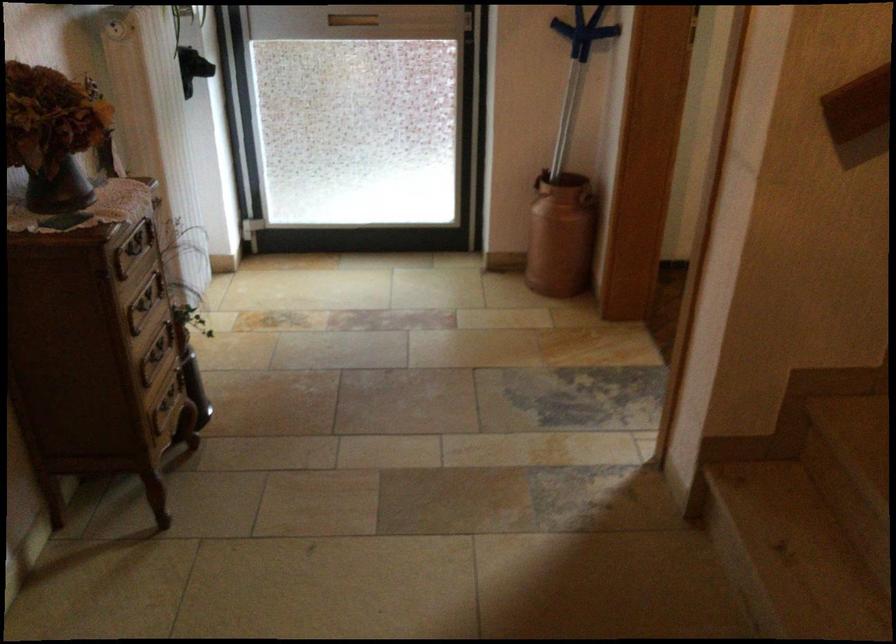
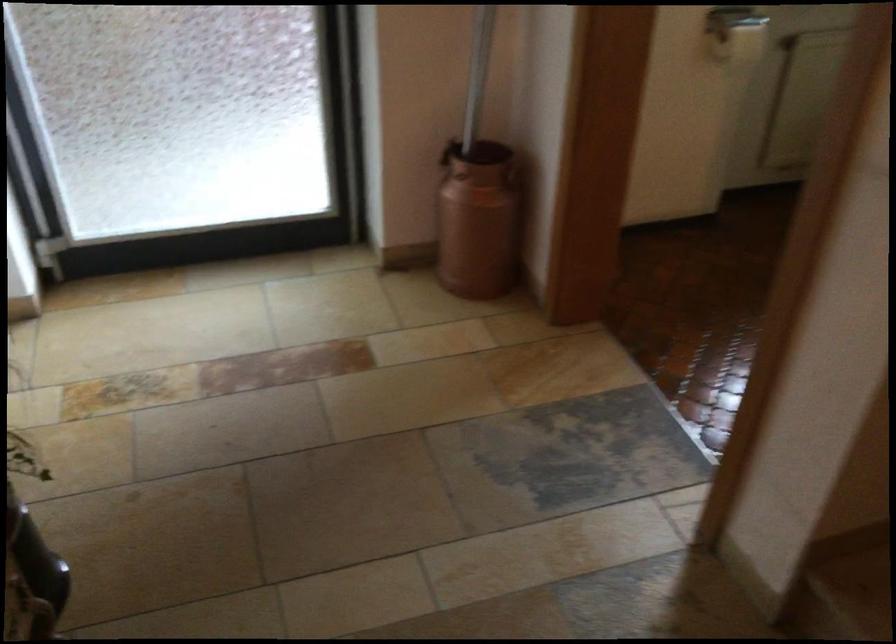
Locate, in the second image, the point that corresponds to [560,118] in the first image.

(478, 73)